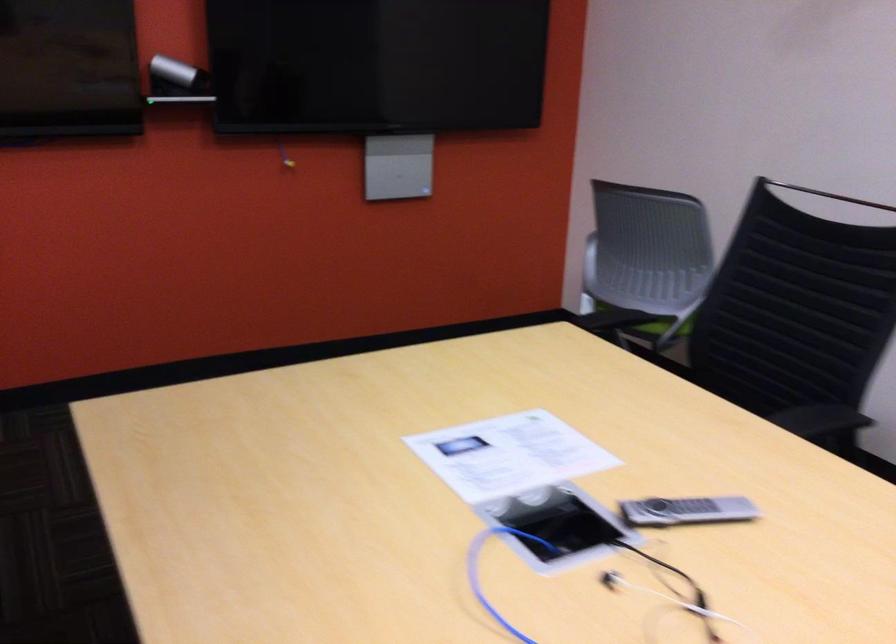
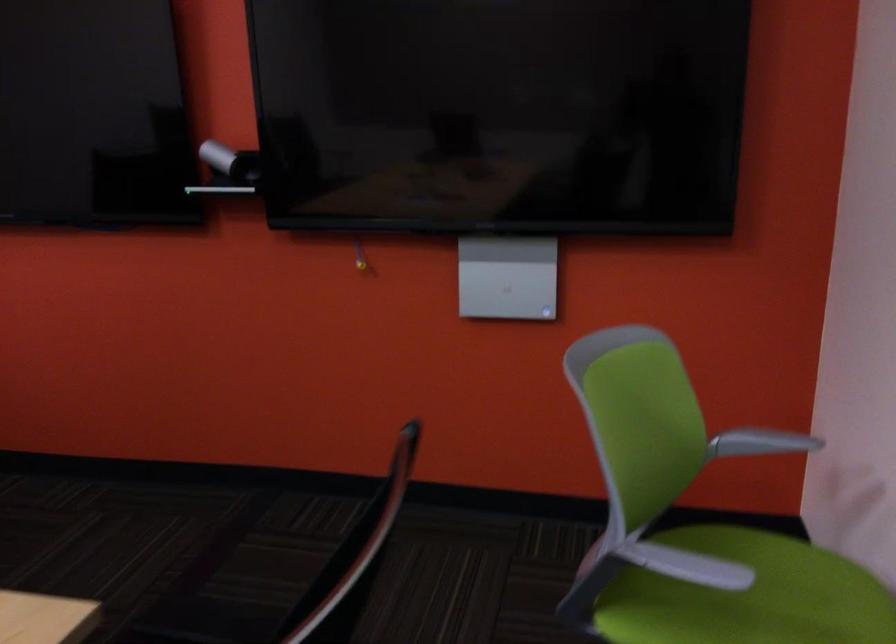
In the second image, find the point that corresponds to (173,73) in the first image.

(230, 162)